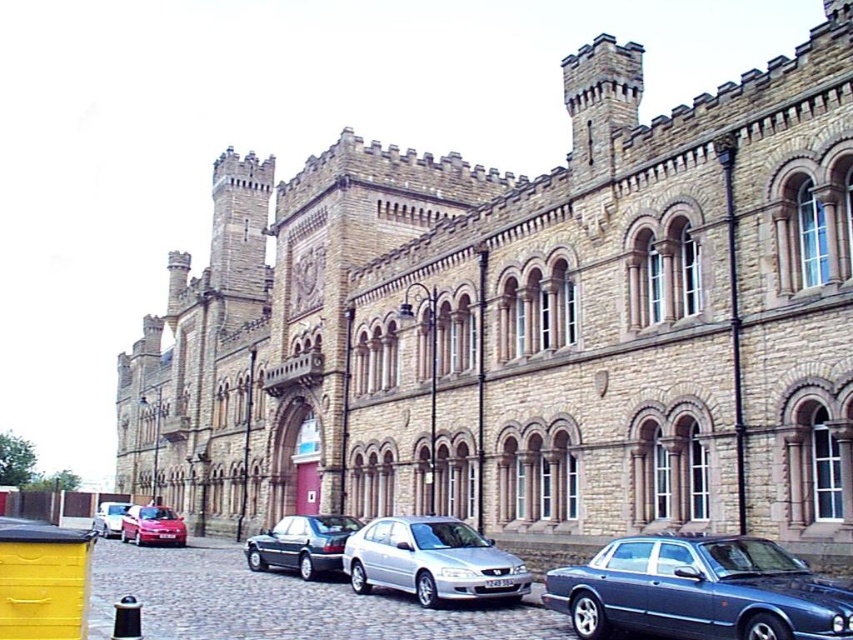
What do you see at coordinates (431, 561) in the screenshot? I see `silver metallic sedan at center` at bounding box center [431, 561].

Identify the location of silver metallic sedan at center. The height and width of the screenshot is (640, 853). (431, 561).

Looking at this image, is shiny dark gray sedan at center shorter than matte red car at lower left?

Yes.

Which is behind, point (291, 547) or point (138, 538)?

Point (138, 538)

At what (x,y) coordinates should I click in order to perform the action: click on shiny dark gray sedan at center. Please return your answer as a coordinate pair (x, y). Image resolution: width=853 pixels, height=640 pixels. Looking at the image, I should click on (300, 545).

Who is taller, metallic blue sedan at lower right or silver metallic car at lower left?

metallic blue sedan at lower right is taller.

Who is positioned more to the right, metallic blue sedan at lower right or silver metallic car at lower left?

metallic blue sedan at lower right is more to the right.

Which is in front, point (722, 561) or point (122, 512)?

Positioned in front is point (722, 561).

You are a GUI agent. You are given a task and a screenshot of the screen. Output one action in this format:
    pyautogui.click(x=<x>, y=<y>)
    Task: Click on the metallic blue sedan at lower right
    Image resolution: width=853 pixels, height=640 pixels.
    Given the screenshot: What is the action you would take?
    pyautogui.click(x=698, y=589)